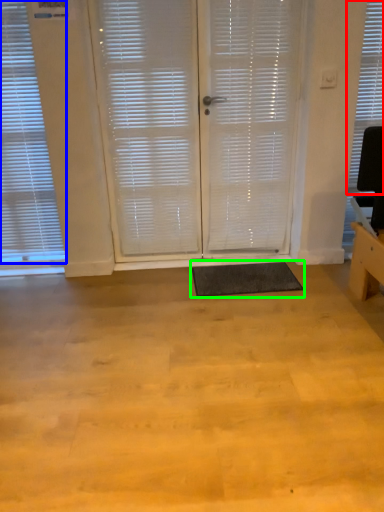
Question: Which is nearer to the window blind (highlighted by a red box)? window blind (highlighted by a blue box) or yoga mat (highlighted by a green box).

Choices:
 (A) window blind
 (B) yoga mat

Answer: (B)